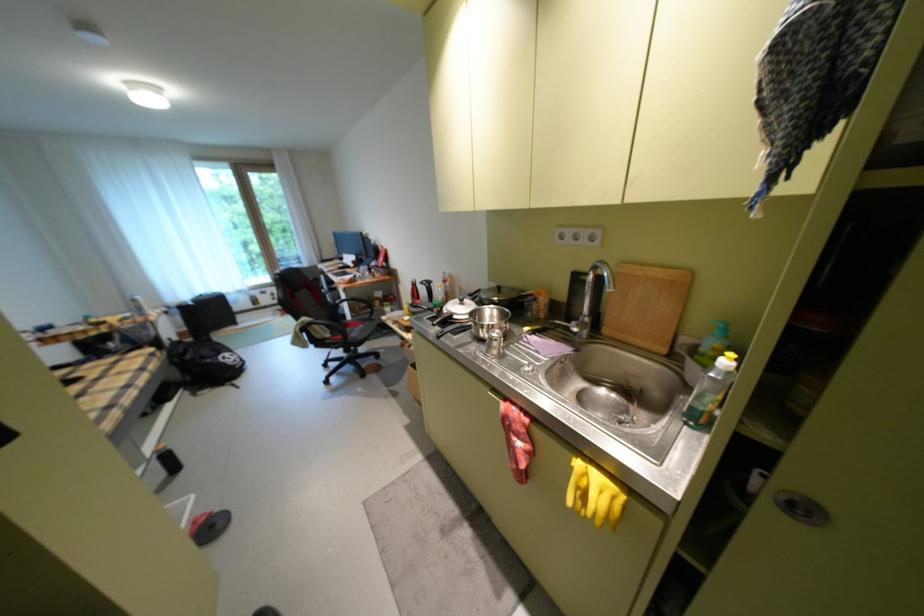
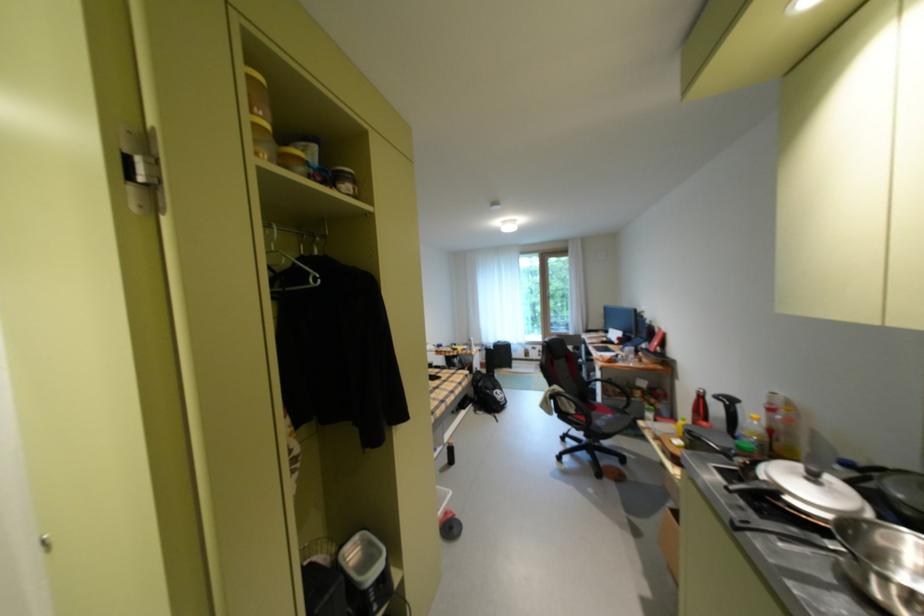
Locate, in the second image, the point that corresponds to point (492, 336) in the first image.

(888, 594)